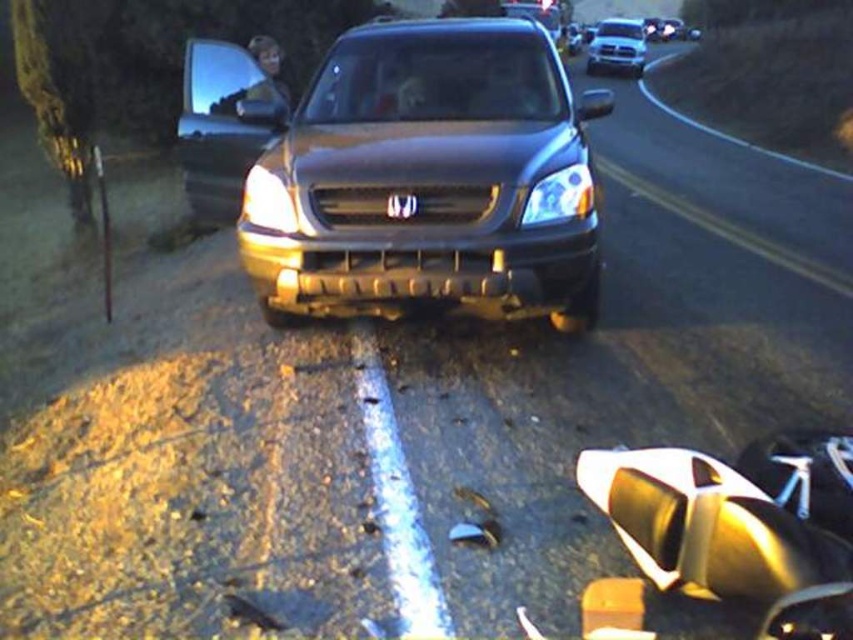
Question: Which object appears closest to the camera in this image?

Choices:
 (A) matte plastic headlight at center
 (B) silver metallic truck at upper center
 (C) matte black headlight at center

Answer: (A)

Question: Based on their relative distances, which object is nearer to the matte black headlight at center?

Choices:
 (A) satin black suv at center
 (B) matte plastic headlight at center
 (C) silver metallic truck at upper center

Answer: (A)

Question: Which object appears farthest from the camera in this image?

Choices:
 (A) matte black headlight at center
 (B) silver metallic truck at upper center

Answer: (B)

Question: Is matte plastic headlight at center thinner than silver metallic truck at upper center?

Choices:
 (A) yes
 (B) no

Answer: (A)

Question: Does silver metallic truck at upper center have a lesser width compared to matte black headlight at center?

Choices:
 (A) no
 (B) yes

Answer: (A)

Question: Does silver metallic truck at upper center have a greater width compared to matte black headlight at center?

Choices:
 (A) no
 (B) yes

Answer: (B)